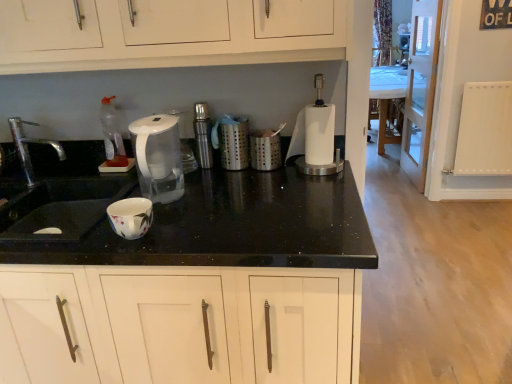
Question: Is silver metallic faucet at left directly adjacent to black granite countertop at center?

Choices:
 (A) yes
 (B) no

Answer: (B)

Question: From a real-world perspective, is silver metallic faucet at left under black granite countertop at center?

Choices:
 (A) yes
 (B) no

Answer: (B)

Question: Is silver metallic faucet at left not close to black granite countertop at center?

Choices:
 (A) no
 (B) yes

Answer: (A)

Question: Could you tell me if silver metallic faucet at left is turned towards black granite countertop at center?

Choices:
 (A) yes
 (B) no

Answer: (B)

Question: Considering the relative sizes of silver metallic faucet at left and black granite countertop at center in the image provided, is silver metallic faucet at left bigger than black granite countertop at center?

Choices:
 (A) no
 (B) yes

Answer: (A)

Question: In the image, is white plastic blender at center on the left side or the right side of black granite countertop at center?

Choices:
 (A) left
 (B) right

Answer: (B)

Question: Considering their positions, is white plastic blender at center located in front of or behind black granite countertop at center?

Choices:
 (A) front
 (B) behind

Answer: (B)

Question: From the image's perspective, is white plastic blender at center positioned above or below black granite countertop at center?

Choices:
 (A) above
 (B) below

Answer: (A)

Question: Is white plastic blender at center spatially inside black granite countertop at center, or outside of it?

Choices:
 (A) inside
 (B) outside

Answer: (B)

Question: Is point (375, 97) closer or farther from the camera than point (28, 170)?

Choices:
 (A) farther
 (B) closer

Answer: (A)

Question: From a real-world perspective, relative to silver metallic faucet at left, is white glossy table at center vertically above or below?

Choices:
 (A) above
 (B) below

Answer: (B)

Question: From their relative heights in the image, would you say white glossy table at center is taller or shorter than silver metallic faucet at left?

Choices:
 (A) short
 (B) tall

Answer: (B)

Question: Would you say white glossy table at center is to the left or to the right of silver metallic faucet at left in the picture?

Choices:
 (A) left
 (B) right

Answer: (B)

Question: Choose the correct answer: Is black granite countertop at center inside white glossy table at center or outside it?

Choices:
 (A) inside
 (B) outside

Answer: (B)

Question: From a real-world perspective, is black granite countertop at center above or below white glossy table at center?

Choices:
 (A) above
 (B) below

Answer: (A)